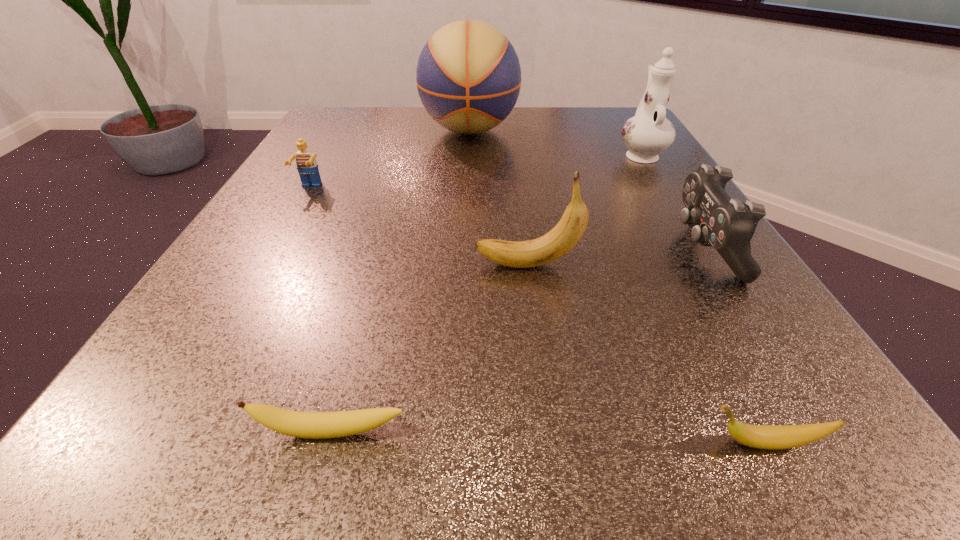
This screenshot has height=540, width=960. Identify the location of basketball. (468, 76).

Locate an element on the screen. Image resolution: width=960 pixels, height=540 pixels. chinaware is located at coordinates (648, 133).

This screenshot has height=540, width=960. In order to click on the tallest banana in this screenshot , I will do [x=564, y=236].

The width and height of the screenshot is (960, 540). Find the location of `the third tallest object`. the third tallest object is located at coordinates (564, 236).

Image resolution: width=960 pixels, height=540 pixels. I want to click on control, so click(x=728, y=225).

Where is `Lego`? Lego is located at coordinates (307, 166).

Locate an element on the screen. Image resolution: width=960 pixels, height=540 pixels. the fifth tallest object is located at coordinates (307, 166).

At what (x,y) coordinates should I click in order to perform the action: click on the rightmost banana. Please return your answer as a coordinate pair (x, y). The image size is (960, 540). Looking at the image, I should click on (773, 437).

The height and width of the screenshot is (540, 960). In order to click on the leftmost banana in this screenshot , I will do `click(314, 425)`.

Where is `vacant space located 0.320m on the patterned surface of the basketball`? Image resolution: width=960 pixels, height=540 pixels. vacant space located 0.320m on the patterned surface of the basketball is located at coordinates (465, 242).